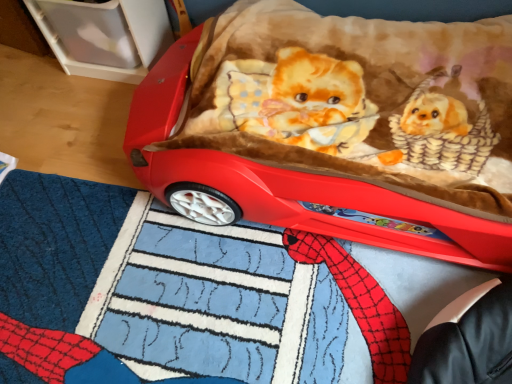
This screenshot has height=384, width=512. In order to click on free space above blue plush mat at lower center (from a real-world perspective) in this screenshot , I will do `click(158, 306)`.